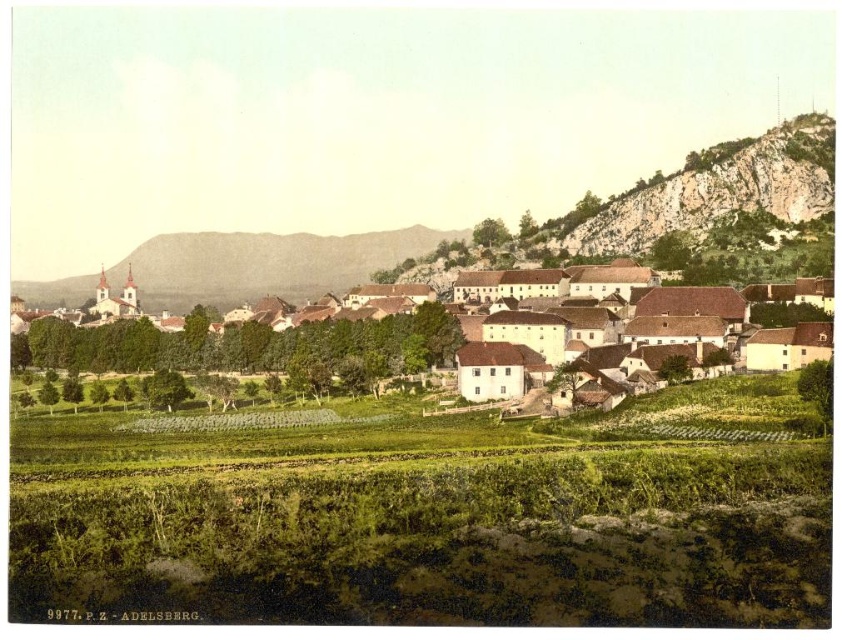
Question: Is green grassy vineyard at center bigger than white matte buildings at center?

Choices:
 (A) yes
 (B) no

Answer: (B)

Question: Among these points, which one is farthest from the camera?

Choices:
 (A) (669, 536)
 (B) (340, 358)

Answer: (B)

Question: Is green grassy vineyard at center positioned before white matte buildings at center?

Choices:
 (A) no
 (B) yes

Answer: (B)

Question: Can you confirm if green grassy vineyard at center is bigger than white matte buildings at center?

Choices:
 (A) yes
 (B) no

Answer: (B)